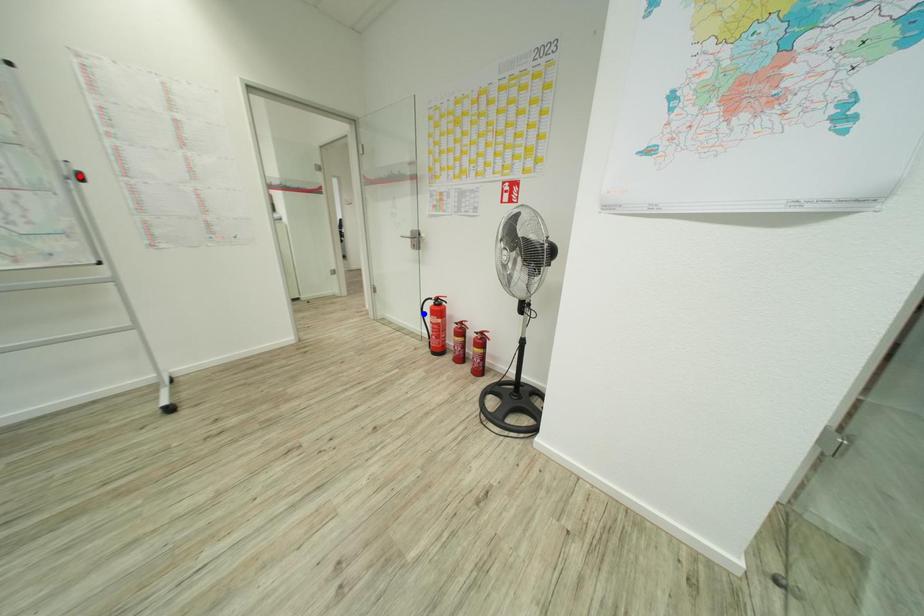
Question: Which of the two points in the image is closer to the camera?

Choices:
 (A) Blue point is closer.
 (B) Red point is closer.

Answer: (B)